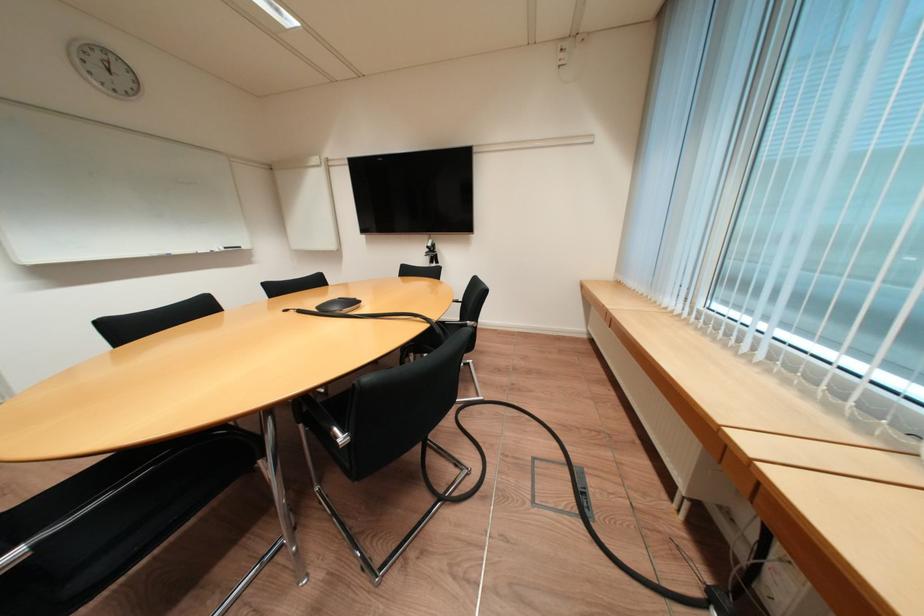
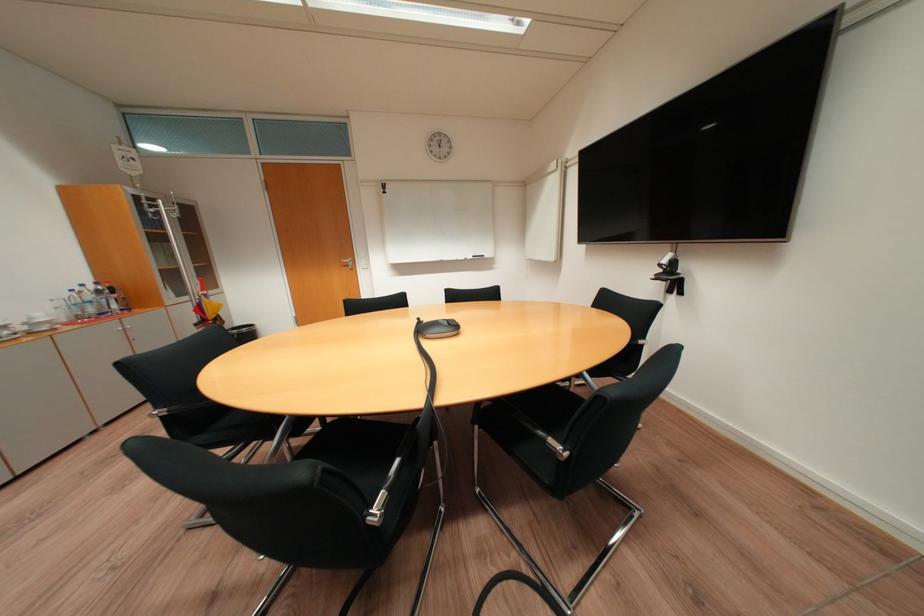
Find the pixel in the second image that matches point (439, 246) in the first image.

(673, 262)